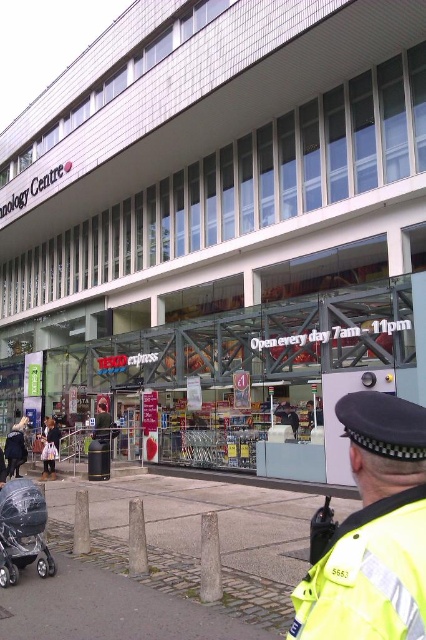
Question: Can you confirm if dark blue jeans at lower left is positioned above dark gray jacket at center?

Choices:
 (A) yes
 (B) no

Answer: (B)

Question: Can you confirm if silver metallic stroller at lower left is smaller than dark blue jeans at lower left?

Choices:
 (A) no
 (B) yes

Answer: (B)

Question: Which point appears closest to the camera in this image?

Choices:
 (A) (103, 440)
 (B) (423, 625)
 (C) (46, 468)

Answer: (B)

Question: Which point is closer to the camera taking this photo?

Choices:
 (A) (54, 451)
 (B) (385, 461)
 (C) (11, 428)

Answer: (B)

Question: Among these points, which one is farthest from the camera?

Choices:
 (A) (54, 452)
 (B) (48, 552)
 (C) (6, 442)
 (D) (106, 424)

Answer: (D)

Question: Does yellow reflective uniform at lower right have a smaller size compared to dark gray jacket at center?

Choices:
 (A) yes
 (B) no

Answer: (A)